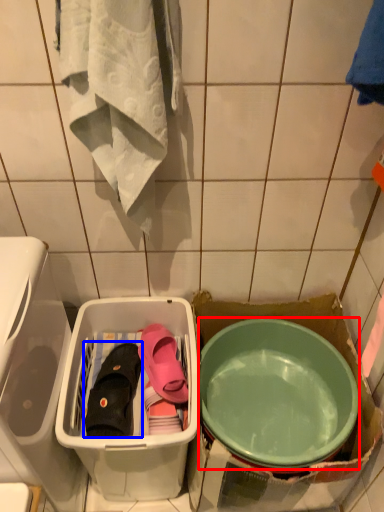
Question: Among these objects, which one is farthest to the camera, mixing bowl (highlighted by a red box) or footwear (highlighted by a blue box)?

Choices:
 (A) mixing bowl
 (B) footwear

Answer: (B)